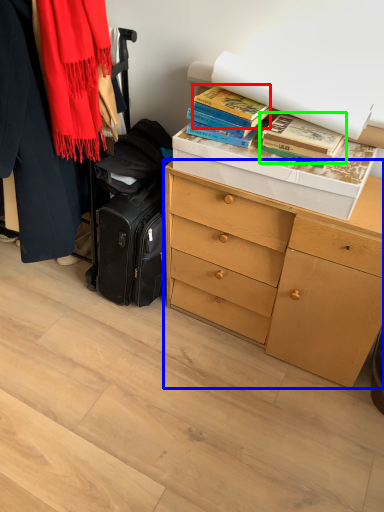
Question: Considering the real-world distances, which object is farthest from book (highlighted by a red box)? chest of drawers (highlighted by a blue box) or book (highlighted by a green box)?

Choices:
 (A) chest of drawers
 (B) book

Answer: (A)